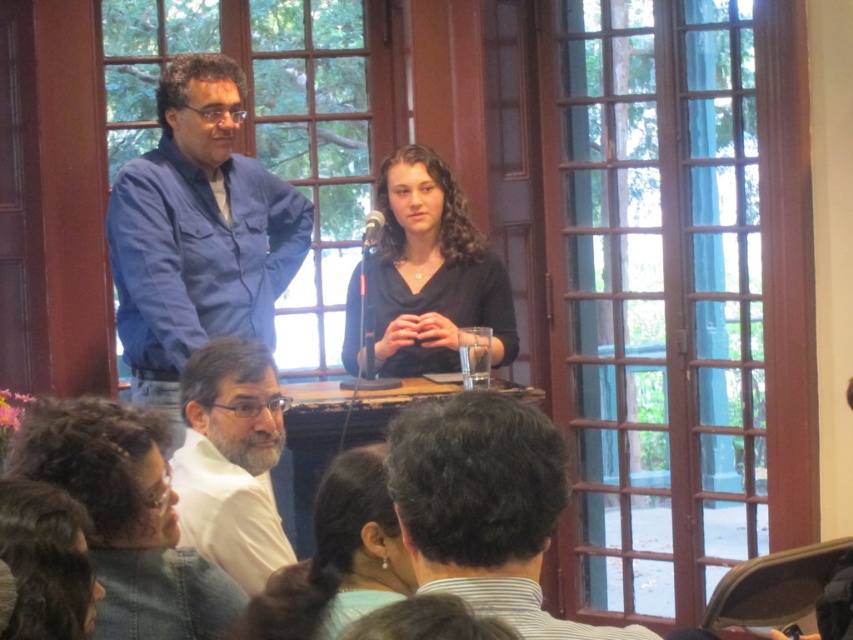
Who is positioned more to the left, dark brown hair at center or black matte shirt at center?

black matte shirt at center

Is dark brown hair at center behind black matte shirt at center?

No, it is in front of black matte shirt at center.

At what (x,y) coordinates should I click in order to perform the action: click on dark brown hair at center. Please return your answer as a coordinate pair (x, y). This screenshot has height=640, width=853. Looking at the image, I should click on (485, 506).

Who is higher up, blue cotton shirt at upper left or black matte shirt at center?

blue cotton shirt at upper left

Is blue cotton shirt at upper left to the left of black matte shirt at center from the viewer's perspective?

Indeed, blue cotton shirt at upper left is positioned on the left side of black matte shirt at center.

Between point (173, 372) and point (403, 374), which one is positioned in front?

Positioned in front is point (173, 372).

At what (x,y) coordinates should I click in order to perform the action: click on blue cotton shirt at upper left. Please return your answer as a coordinate pair (x, y). Looking at the image, I should click on (196, 232).

Can you confirm if blue cotton shirt at upper left is wider than white matte shirt at lower left?

Correct, the width of blue cotton shirt at upper left exceeds that of white matte shirt at lower left.

Does blue cotton shirt at upper left have a smaller size compared to white matte shirt at lower left?

No.

In order to click on blue cotton shirt at upper left in this screenshot , I will do `click(196, 232)`.

Where is `blue cotton shirt at upper left`? Image resolution: width=853 pixels, height=640 pixels. blue cotton shirt at upper left is located at coordinates (196, 232).